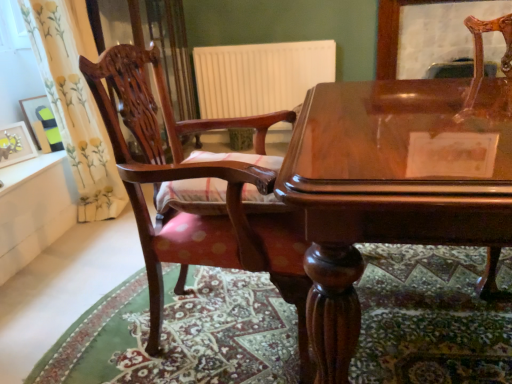
Where is `mahogany wood chair at left`? This screenshot has height=384, width=512. mahogany wood chair at left is located at coordinates (201, 193).

The image size is (512, 384). I want to click on matte yellow picture frame at left, the 2th picture frame in the back-to-front sequence, so click(x=15, y=144).

In order to click on floral fabric curtain at left in this screenshot , I will do `click(75, 102)`.

The width and height of the screenshot is (512, 384). Describe the element at coordinates (394, 187) in the screenshot. I see `glossy wood table at center` at that location.

Image resolution: width=512 pixels, height=384 pixels. What are the coordinates of `white matte radiator at center` in the screenshot? It's located at (260, 76).

From a real-world perspective, between matte yellow picture frame at left, the 2th picture frame in the back-to-front sequence, and floral fabric curtain at left, who is vertically higher?

In real-world perspective, floral fabric curtain at left is above.

Could you measure the distance between matte yellow picture frame at left, which is the first picture frame from front to back, and floral fabric curtain at left?

matte yellow picture frame at left, which is the first picture frame from front to back, and floral fabric curtain at left are 14.13 inches apart from each other.

Is matte yellow picture frame at left, the 2th picture frame in the back-to-front sequence, in front of or behind floral fabric curtain at left in the image?

Clearly, matte yellow picture frame at left, the 2th picture frame in the back-to-front sequence, is behind floral fabric curtain at left.

Is matte yellow picture frame at left, which is the first picture frame from front to back, not within floral fabric curtain at left?

Yes.

Relative to carpeted floor at lower center, is matte black picture frame at left, the second picture frame from the front, in front or behind?

matte black picture frame at left, the second picture frame from the front, is positioned farther from the viewer than carpeted floor at lower center.

Does matte black picture frame at left, the second picture frame from the front, have a lesser width compared to carpeted floor at lower center?

Indeed, matte black picture frame at left, the second picture frame from the front, has a lesser width compared to carpeted floor at lower center.

From the image's perspective, relative to carpeted floor at lower center, is matte black picture frame at left, the first picture frame viewed from the back, above or below?

matte black picture frame at left, the first picture frame viewed from the back, is situated higher than carpeted floor at lower center in the image.

Is white matte radiator at center further to the viewer compared to matte yellow picture frame at left, the 2th picture frame in the back-to-front sequence?

Yes, the depth of white matte radiator at center is greater than that of matte yellow picture frame at left, the 2th picture frame in the back-to-front sequence.

Between white matte radiator at center and matte yellow picture frame at left, the 2th picture frame in the back-to-front sequence, which one has less height?

matte yellow picture frame at left, the 2th picture frame in the back-to-front sequence.

Is white matte radiator at center positioned beyond the bounds of matte yellow picture frame at left, the 2th picture frame in the back-to-front sequence?

Absolutely, white matte radiator at center is external to matte yellow picture frame at left, the 2th picture frame in the back-to-front sequence.

You are a GUI agent. You are given a task and a screenshot of the screen. Output one action in this format:
    pyautogui.click(x=<x>, y=<y>)
    Task: Click on the picture frame that is under the white matte radiator at center (from a real-world perspective)
    This screenshot has width=512, height=384.
    Given the screenshot: What is the action you would take?
    pyautogui.click(x=15, y=144)

Does matte black picture frame at left, the second picture frame from the front, have a greater width compared to white matte radiator at center?

No.

Looking at the image, does matte black picture frame at left, the second picture frame from the front, seem bigger or smaller compared to white matte radiator at center?

matte black picture frame at left, the second picture frame from the front, is smaller than white matte radiator at center.

From a real-world perspective, which is physically below, matte black picture frame at left, the first picture frame viewed from the back, or white matte radiator at center?

white matte radiator at center is physically lower.

From the image's perspective, relative to white matte radiator at center, is matte black picture frame at left, the second picture frame from the front, above or below?

matte black picture frame at left, the second picture frame from the front, is below white matte radiator at center.

Which point is more forward, (334, 306) or (58, 16)?

The point (334, 306) is more forward.

Locate an element on the screen. This screenshot has width=512, height=384. table below the floral fabric curtain at left (from the image's perspective) is located at coordinates (394, 187).

From a real-world perspective, is glossy wood table at center under floral fabric curtain at left?

Yes, from a real-world perspective, glossy wood table at center is below floral fabric curtain at left.

Is floral fabric curtain at left bigger or smaller than white matte radiator at center?

Considering their sizes, floral fabric curtain at left takes up more space than white matte radiator at center.

Considering the sizes of objects floral fabric curtain at left and white matte radiator at center in the image provided, who is shorter, floral fabric curtain at left or white matte radiator at center?

With less height is white matte radiator at center.

Which point is more distant from viewer, (71, 4) or (196, 52)?

Positioned behind is point (196, 52).

Which object is positioned more to the left, floral fabric curtain at left or white matte radiator at center?

floral fabric curtain at left.

From the image's perspective, is mahogany wood chair at left above matte black picture frame at left, the second picture frame from the front?

No.

Is the depth of mahogany wood chair at left less than that of matte black picture frame at left, the second picture frame from the front?

Yes, mahogany wood chair at left is closer to the viewer.

Where is `curtain on the right of matte yellow picture frame at left, which is the first picture frame from front to back`? The height and width of the screenshot is (384, 512). curtain on the right of matte yellow picture frame at left, which is the first picture frame from front to back is located at coordinates (75, 102).

In the image, there is a matte black picture frame at left, the first picture frame viewed from the back. In order to click on mat below it (from the image's perspective) in this screenshot , I will do `click(181, 334)`.

Estimate the real-world distances between objects in this image. Which object is closer to carpeted floor at lower center, mahogany wood chair at left or glossy wood table at center?

Among the two, mahogany wood chair at left is located nearer to carpeted floor at lower center.

Based on their spatial positions, is glossy wood table at center or matte black picture frame at left, the first picture frame viewed from the back, closer to carpeted floor at lower center?

The object closer to carpeted floor at lower center is glossy wood table at center.

From the image, which object appears to be farther from white matte radiator at center, glossy wood table at center or carpeted floor at lower center?

glossy wood table at center.

Looking at the image, which one is located further to carpeted floor at lower center, white matte radiator at center or matte yellow picture frame at left, which is the first picture frame from front to back?

white matte radiator at center is further to carpeted floor at lower center.

From the image, which object appears to be nearer to mahogany wood chair at left, matte black picture frame at left, the second picture frame from the front, or white matte radiator at center?

The object closer to mahogany wood chair at left is matte black picture frame at left, the second picture frame from the front.

From the image, which object appears to be nearer to mahogany wood chair at left, glossy wood table at center or matte black picture frame at left, the first picture frame viewed from the back?

glossy wood table at center is positioned closer to the anchor mahogany wood chair at left.

From the image, which object appears to be farther from white matte radiator at center, matte yellow picture frame at left, the 2th picture frame in the back-to-front sequence, or floral fabric curtain at left?

Among the two, matte yellow picture frame at left, the 2th picture frame in the back-to-front sequence, is located further to white matte radiator at center.

When comparing their distances from carpeted floor at lower center, does matte black picture frame at left, the first picture frame viewed from the back, or floral fabric curtain at left seem closer?

Among the two, floral fabric curtain at left is located nearer to carpeted floor at lower center.

In order to click on mat between floral fabric curtain at left and glossy wood table at center in the horizontal direction in this screenshot , I will do `click(181, 334)`.

You are a GUI agent. You are given a task and a screenshot of the screen. Output one action in this format:
    pyautogui.click(x=<x>, y=<y>)
    Task: Click on the picture frame between matte yellow picture frame at left, which is the first picture frame from front to back, and white matte radiator at center, in the horizontal direction
    The image size is (512, 384).
    Given the screenshot: What is the action you would take?
    pyautogui.click(x=42, y=121)

This screenshot has height=384, width=512. In order to click on mat between glossy wood table at center and white matte radiator at center in the front-back direction in this screenshot , I will do pos(181,334).

The height and width of the screenshot is (384, 512). Find the location of `picture frame between matte yellow picture frame at left, the 2th picture frame in the back-to-front sequence, and carpeted floor at lower center`. picture frame between matte yellow picture frame at left, the 2th picture frame in the back-to-front sequence, and carpeted floor at lower center is located at coordinates (42, 121).